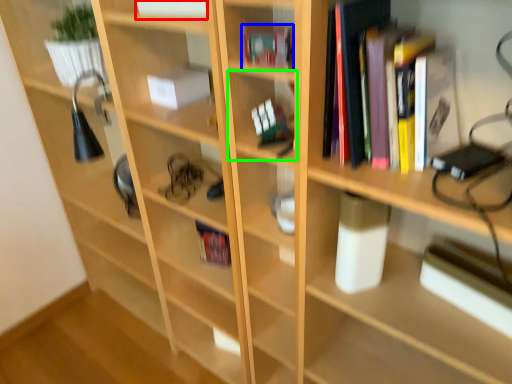
Question: Estimate the real-world distances between objects in this image. Which object is farther from book (highlighted by a red box), book (highlighted by a blue box) or shelf (highlighted by a green box)?

Choices:
 (A) book
 (B) shelf

Answer: (B)